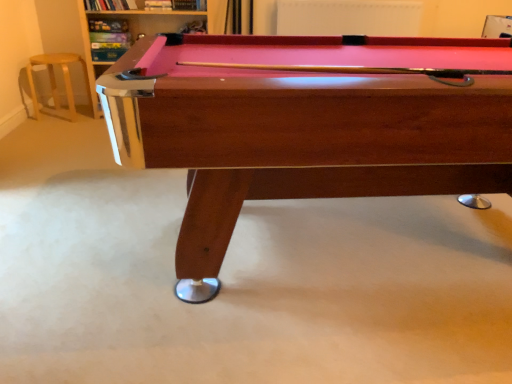
Question: Considering the relative sizes of wooden billiard table at center and metallic silver pool table at upper left in the image provided, is wooden billiard table at center shorter than metallic silver pool table at upper left?

Choices:
 (A) yes
 (B) no

Answer: (A)

Question: From the image's perspective, is wooden billiard table at center over metallic silver pool table at upper left?

Choices:
 (A) yes
 (B) no

Answer: (B)

Question: Is wooden billiard table at center not inside metallic silver pool table at upper left?

Choices:
 (A) yes
 (B) no

Answer: (A)

Question: From the image's perspective, is wooden billiard table at center beneath metallic silver pool table at upper left?

Choices:
 (A) no
 (B) yes

Answer: (B)

Question: From a real-world perspective, does wooden billiard table at center sit lower than metallic silver pool table at upper left?

Choices:
 (A) no
 (B) yes

Answer: (B)

Question: Is the depth of wooden billiard table at center greater than that of metallic silver pool table at upper left?

Choices:
 (A) no
 (B) yes

Answer: (A)

Question: Does wooden billiard table at center appear on the right side of light wood bar stool at left?

Choices:
 (A) no
 (B) yes

Answer: (B)

Question: Is wooden billiard table at center outside light wood bar stool at left?

Choices:
 (A) no
 (B) yes

Answer: (B)

Question: From the image's perspective, is wooden billiard table at center located above light wood bar stool at left?

Choices:
 (A) yes
 (B) no

Answer: (B)

Question: Is wooden billiard table at center not close to light wood bar stool at left?

Choices:
 (A) no
 (B) yes

Answer: (B)

Question: Is wooden billiard table at center bigger than light wood bar stool at left?

Choices:
 (A) yes
 (B) no

Answer: (A)

Question: Is wooden billiard table at center smaller than light wood bar stool at left?

Choices:
 (A) yes
 (B) no

Answer: (B)

Question: Is metallic silver pool table at upper left bigger than wooden billiard table at center?

Choices:
 (A) yes
 (B) no

Answer: (B)